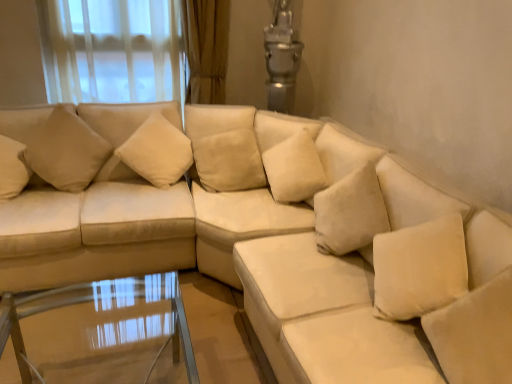
Question: From a real-world perspective, is beige fabric pillow at upper left, which is the first pillow in left-to-right order, on top of soft white pillow at lower right, the 1th pillow from the right?

Choices:
 (A) yes
 (B) no

Answer: (A)

Question: Are beige fabric pillow at upper left, the 4th pillow when ordered from right to left, and soft white pillow at lower right, the 1th pillow from the right, far apart?

Choices:
 (A) yes
 (B) no

Answer: (A)

Question: Is beige fabric pillow at upper left, the 4th pillow when ordered from right to left, thinner than soft white pillow at lower right, the fourth pillow in the left-to-right sequence?

Choices:
 (A) no
 (B) yes

Answer: (A)

Question: From the image's perspective, is beige fabric pillow at upper left, which is the first pillow in left-to-right order, above soft white pillow at lower right, the fourth pillow in the left-to-right sequence?

Choices:
 (A) no
 (B) yes

Answer: (B)

Question: Is beige fabric pillow at upper left, the 4th pillow when ordered from right to left, in front of soft white pillow at lower right, the fourth pillow in the left-to-right sequence?

Choices:
 (A) no
 (B) yes

Answer: (A)

Question: Is beige fabric pillow at upper left, which is the first pillow in left-to-right order, aimed at soft white pillow at lower right, the 1th pillow from the right?

Choices:
 (A) no
 (B) yes

Answer: (B)

Question: Can you confirm if suede beige couch at left is wider than beige fabric pillow at upper left, which is the first pillow in left-to-right order?

Choices:
 (A) yes
 (B) no

Answer: (A)

Question: Is suede beige couch at left facing towards beige fabric pillow at upper left, the 4th pillow when ordered from right to left?

Choices:
 (A) yes
 (B) no

Answer: (A)

Question: Is suede beige couch at left to the right of beige fabric pillow at upper left, the 4th pillow when ordered from right to left, from the viewer's perspective?

Choices:
 (A) no
 (B) yes

Answer: (B)

Question: Is suede beige couch at left completely or partially outside of beige fabric pillow at upper left, which is the first pillow in left-to-right order?

Choices:
 (A) no
 (B) yes

Answer: (B)

Question: Are suede beige couch at left and beige fabric pillow at upper left, the 4th pillow when ordered from right to left, beside each other?

Choices:
 (A) no
 (B) yes

Answer: (A)

Question: Can you confirm if suede beige couch at left is bigger than beige fabric pillow at upper left, which is the first pillow in left-to-right order?

Choices:
 (A) yes
 (B) no

Answer: (A)

Question: From the image's perspective, is beige fabric pillow at upper left, positioned as the second pillow in left-to-right order, on transparent glass table at lower center?

Choices:
 (A) no
 (B) yes

Answer: (B)